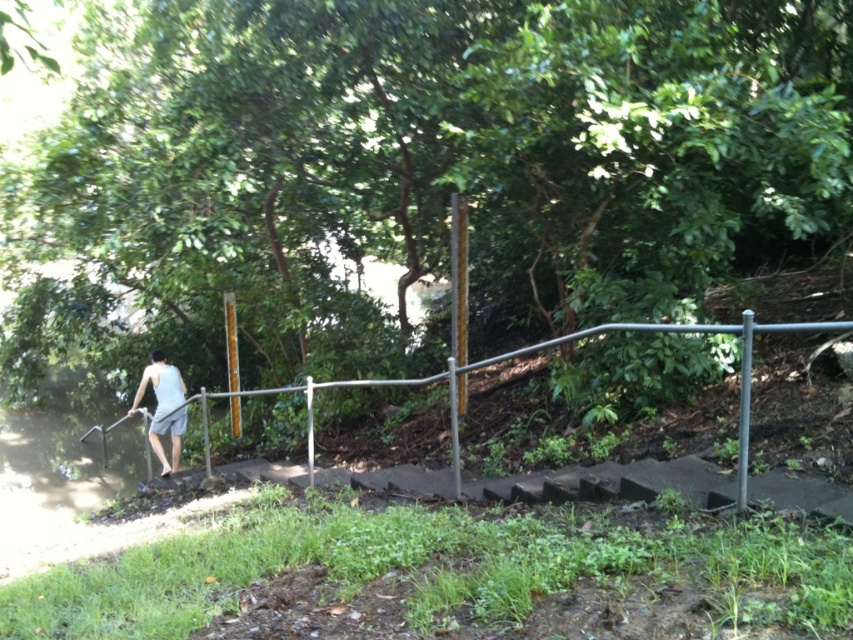
Question: Is silver metallic rail at center below light gray tank top at left?

Choices:
 (A) yes
 (B) no

Answer: (B)

Question: Can you confirm if silver metallic rail at center is thinner than light gray tank top at left?

Choices:
 (A) yes
 (B) no

Answer: (B)

Question: Is silver metallic rail at center below light gray tank top at left?

Choices:
 (A) no
 (B) yes

Answer: (A)

Question: Which object appears farthest from the camera in this image?

Choices:
 (A) silver metallic rail at center
 (B) light gray tank top at left

Answer: (B)

Question: Which object appears closest to the camera in this image?

Choices:
 (A) silver metallic rail at center
 (B) light gray tank top at left

Answer: (A)